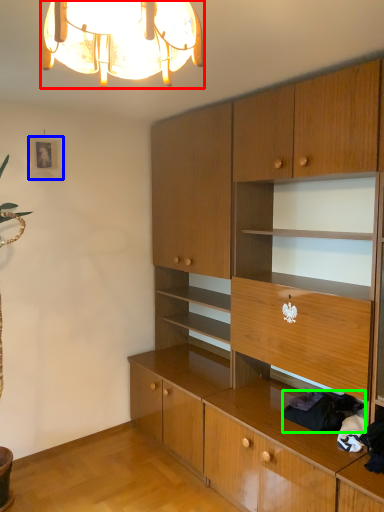
Question: Considering the real-world distances, which object is farthest from lamp (highlighted by a red box)? picture frame (highlighted by a blue box) or clothing (highlighted by a green box)?

Choices:
 (A) picture frame
 (B) clothing

Answer: (A)